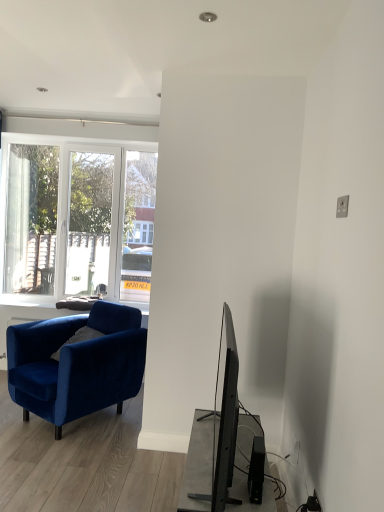
Question: Is black plastic speaker at lower right not close to velvet blue armchair at left?

Choices:
 (A) yes
 (B) no

Answer: (A)

Question: Can you confirm if black plastic speaker at lower right is shorter than velvet blue armchair at left?

Choices:
 (A) yes
 (B) no

Answer: (A)

Question: Does black plastic speaker at lower right have a greater height compared to velvet blue armchair at left?

Choices:
 (A) yes
 (B) no

Answer: (B)

Question: Is black plastic speaker at lower right with velvet blue armchair at left?

Choices:
 (A) yes
 (B) no

Answer: (B)

Question: Is black plastic speaker at lower right closer to the viewer compared to velvet blue armchair at left?

Choices:
 (A) no
 (B) yes

Answer: (B)

Question: Could you tell me if black plastic speaker at lower right is turned towards velvet blue armchair at left?

Choices:
 (A) no
 (B) yes

Answer: (A)

Question: Is the surface of velvet blue armchair at left in direct contact with black plastic speaker at lower right?

Choices:
 (A) yes
 (B) no

Answer: (B)

Question: Does velvet blue armchair at left turn towards black plastic speaker at lower right?

Choices:
 (A) yes
 (B) no

Answer: (B)

Question: From a real-world perspective, is velvet blue armchair at left under black plastic speaker at lower right?

Choices:
 (A) no
 (B) yes

Answer: (B)

Question: Is velvet blue armchair at left positioned with its back to black plastic speaker at lower right?

Choices:
 (A) no
 (B) yes

Answer: (A)

Question: Is velvet blue armchair at left located outside black plastic speaker at lower right?

Choices:
 (A) yes
 (B) no

Answer: (A)

Question: Can you confirm if velvet blue armchair at left is taller than black plastic speaker at lower right?

Choices:
 (A) no
 (B) yes

Answer: (B)

Question: From the image's perspective, is velvet blue armchair at left located above or below black plastic speaker at lower right?

Choices:
 (A) below
 (B) above

Answer: (B)